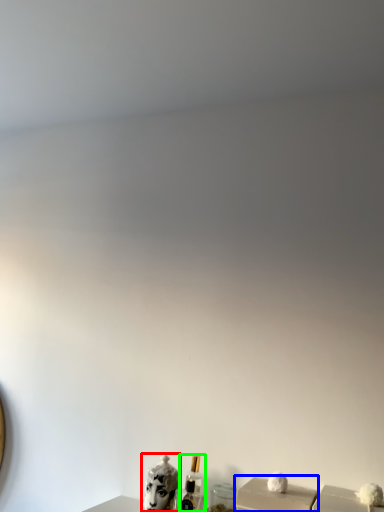
Question: Based on their relative distances, which object is nearer to animal (highlighted by a red box)? Choose from box (highlighted by a blue box) and perfume (highlighted by a green box).

Choices:
 (A) box
 (B) perfume

Answer: (B)